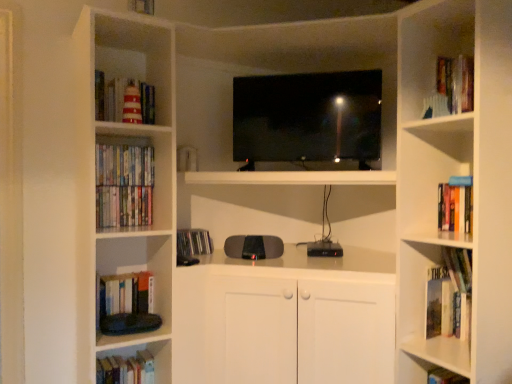
Question: Considering the relative positions of black glossy screen at center and hardcover book at lower right, the 1th book ordered from the bottom, in the image provided, is black glossy screen at center to the left of hardcover book at lower right, the 1th book ordered from the bottom, from the viewer's perspective?

Choices:
 (A) yes
 (B) no

Answer: (A)

Question: From a real-world perspective, is black glossy screen at center positioned over hardcover book at lower right, arranged as the 1th book when viewed from the right, based on gravity?

Choices:
 (A) no
 (B) yes

Answer: (B)

Question: Considering the relative positions of black glossy screen at center and hardcover book at lower right, arranged as the 1th book when viewed from the right, in the image provided, is black glossy screen at center in front of hardcover book at lower right, arranged as the 1th book when viewed from the right,?

Choices:
 (A) yes
 (B) no

Answer: (B)

Question: Can you see black glossy screen at center touching hardcover book at lower right, the 7th book in the top-to-bottom sequence?

Choices:
 (A) no
 (B) yes

Answer: (A)

Question: Considering the relative sizes of black glossy screen at center and hardcover book at lower right, the 1th book ordered from the bottom, in the image provided, is black glossy screen at center wider than hardcover book at lower right, the 1th book ordered from the bottom,?

Choices:
 (A) yes
 (B) no

Answer: (A)

Question: Considering the positions of hardcover book at lower right, the 1th book ordered from the bottom, and hardcover books at lower left, the 6th book viewed from the top, in the image, is hardcover book at lower right, the 1th book ordered from the bottom, taller or shorter than hardcover books at lower left, the 6th book viewed from the top,?

Choices:
 (A) tall
 (B) short

Answer: (A)

Question: Considering the positions of point (459, 382) and point (104, 372), is point (459, 382) closer or farther from the camera than point (104, 372)?

Choices:
 (A) farther
 (B) closer

Answer: (B)

Question: Relative to hardcover books at lower left, arranged as the fifth book when viewed from the right, is hardcover book at lower right, which ranks as the 7th book in left-to-right order, in front or behind?

Choices:
 (A) front
 (B) behind

Answer: (A)

Question: Visually, is hardcover book at lower right, arranged as the 1th book when viewed from the right, positioned to the left or to the right of hardcover books at lower left, the 6th book viewed from the top?

Choices:
 (A) right
 (B) left

Answer: (A)

Question: Considering the positions of matte plastic dvds at left, the second book from the left, and hardcover book at lower right, which ranks as the 7th book in left-to-right order, in the image, is matte plastic dvds at left, the second book from the left, taller or shorter than hardcover book at lower right, which ranks as the 7th book in left-to-right order,?

Choices:
 (A) short
 (B) tall

Answer: (A)

Question: Choose the correct answer: Is matte plastic dvds at left, arranged as the 2th book when viewed from the top, inside hardcover book at lower right, the 1th book ordered from the bottom, or outside it?

Choices:
 (A) outside
 (B) inside

Answer: (A)

Question: Considering the positions of point (126, 178) and point (430, 375), is point (126, 178) closer or farther from the camera than point (430, 375)?

Choices:
 (A) closer
 (B) farther

Answer: (B)

Question: Looking at the image, does matte plastic dvds at left, arranged as the 2th book when viewed from the top, seem bigger or smaller compared to hardcover book at lower right, arranged as the 1th book when viewed from the right?

Choices:
 (A) small
 (B) big

Answer: (B)

Question: Considering the positions of point (121, 215) and point (119, 97), is point (121, 215) closer or farther from the camera than point (119, 97)?

Choices:
 (A) closer
 (B) farther

Answer: (B)

Question: Considering the positions of hardcover books at left, acting as the fifth book starting from the bottom, and striped paper book at upper left, which ranks as the 5th book in left-to-right order, in the image, is hardcover books at left, acting as the fifth book starting from the bottom, wider or thinner than striped paper book at upper left, which ranks as the 5th book in left-to-right order,?

Choices:
 (A) thin
 (B) wide

Answer: (A)